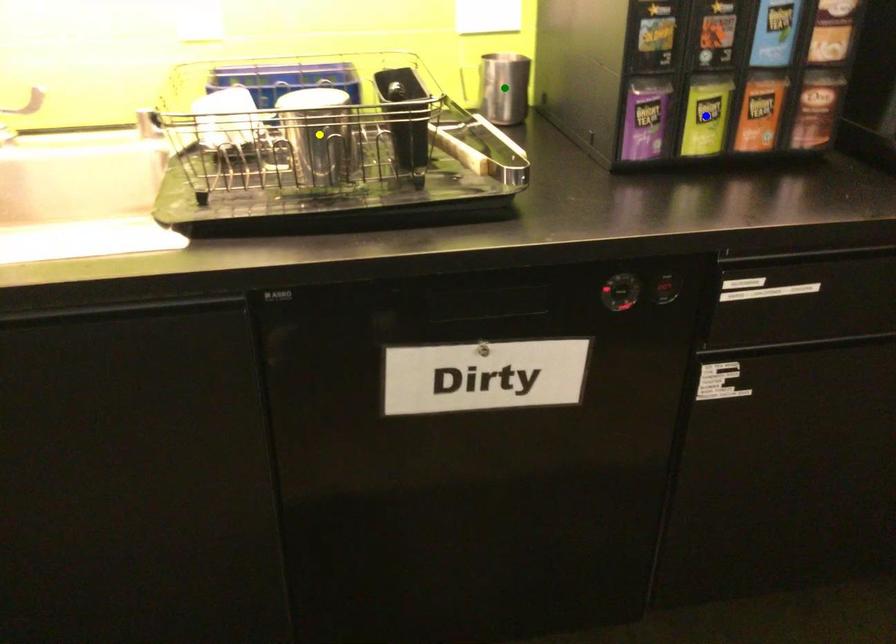
Order these from nearest to farthest:
green point
blue point
yellow point

yellow point, blue point, green point